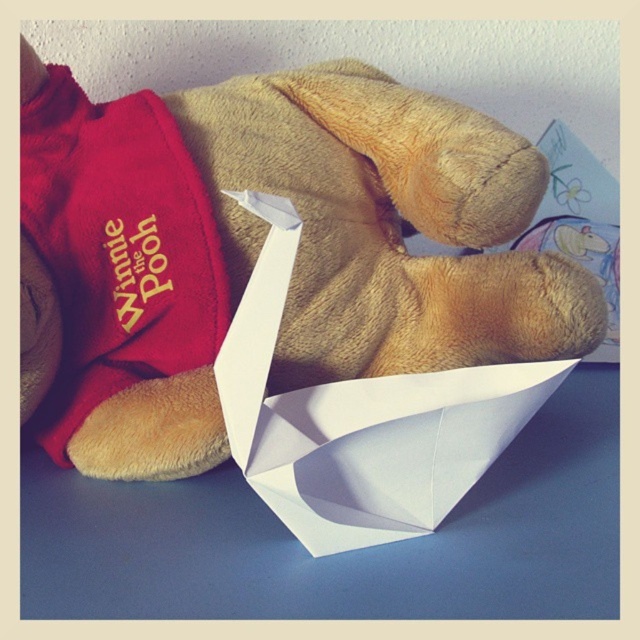
Looking at this image, you are organizing a childrens party and need to arrange the soft plush teddy bear at center and the white paper boat at center on a blue tablecloth. According to the image, which object should be placed to the left side of the tablecloth?

The soft plush teddy bear at center should be placed to the left side of the tablecloth because it is positioned to the left of the white paper boat at center in the image.

What is located at the coordinates point (296, 257) in the image?

The soft plush teddy bear at center is located at point (296, 257).

You are organizing a childrens party and need to arrange the soft plush teddy bear at center and the white paper boat at center on a shelf. The shelf has limited space, and you want to ensure both items can fit side by side. Based on their sizes, can they both fit if the shelf is 1.2 meters wide?

The soft plush teddy bear at center is wider than the white paper boat at center. However, without knowing their exact widths, it is impossible to determine if both can fit on a 1.2 meter wide shelf. More information about their individual dimensions is needed to make an accurate assessment.